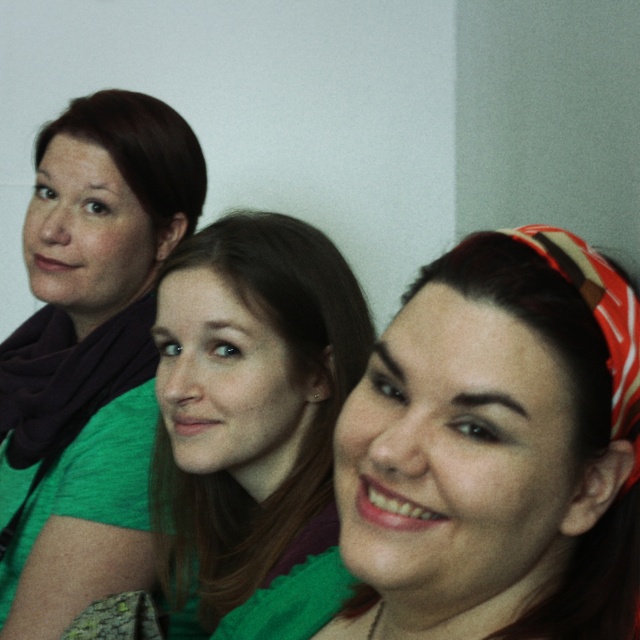
Question: Considering the relative positions of green knitted scarf at center and matte black scarf at left in the image provided, where is green knitted scarf at center located with respect to matte black scarf at left?

Choices:
 (A) left
 (B) right

Answer: (B)

Question: Which point is closer to the camera?

Choices:
 (A) matte black scarf at left
 (B) matte green scarf at center

Answer: (B)

Question: Does matte green scarf at center have a smaller size compared to green knitted scarf at center?

Choices:
 (A) no
 (B) yes

Answer: (B)

Question: Which of the following is the closest to the observer?

Choices:
 (A) green knitted scarf at center
 (B) matte black scarf at left

Answer: (A)

Question: Which object is closer to the camera taking this photo?

Choices:
 (A) matte black scarf at left
 (B) green knitted scarf at center

Answer: (B)

Question: Is matte green scarf at center above matte black scarf at left?

Choices:
 (A) no
 (B) yes

Answer: (A)